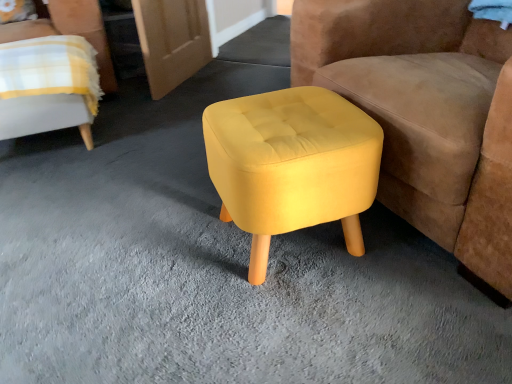
Question: Would you say yellow fabric ottoman at center is to the left or to the right of yellow fabric chair at upper left, which is counted as the 1th chair, starting from the left, in the picture?

Choices:
 (A) left
 (B) right

Answer: (B)

Question: Looking at their shapes, would you say yellow fabric ottoman at center is wider or thinner than yellow fabric chair at upper left, which is counted as the 1th chair, starting from the left?

Choices:
 (A) wide
 (B) thin

Answer: (A)

Question: Estimate the real-world distances between objects in this image. Which object is farther from the yellow fabric ottoman at center, arranged as the first chair when viewed from the right?

Choices:
 (A) yellow fabric ottoman at center
 (B) yellow fabric stool at center
 (C) yellow fabric chair at upper left, which is counted as the 1th chair, starting from the left

Answer: (A)

Question: Estimate the real-world distances between objects in this image. Which object is farther from the yellow fabric ottoman at center?

Choices:
 (A) yellow fabric chair at upper left, which is counted as the 1th chair, starting from the left
 (B) yellow fabric stool at center
 (C) yellow fabric ottoman at center, arranged as the first chair when viewed from the right

Answer: (B)